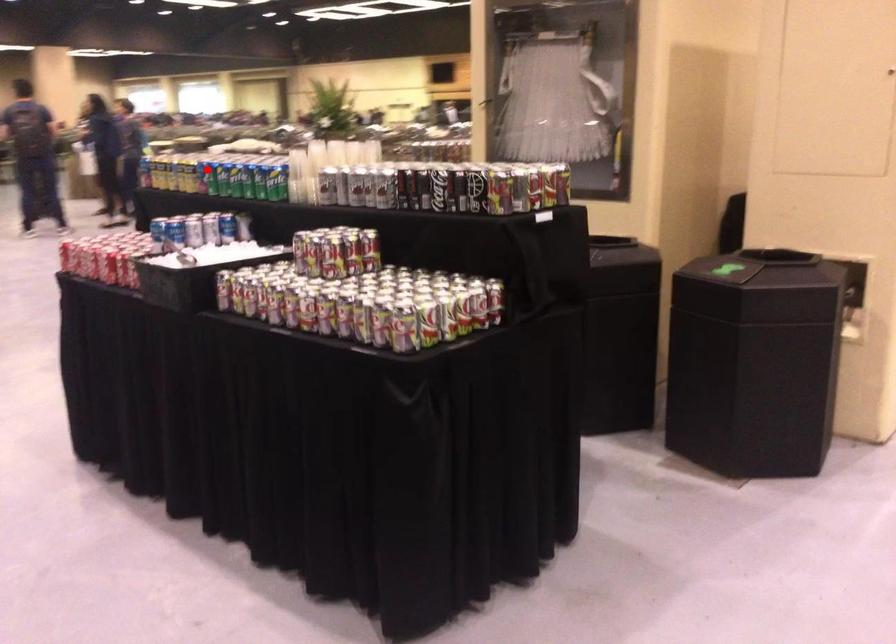
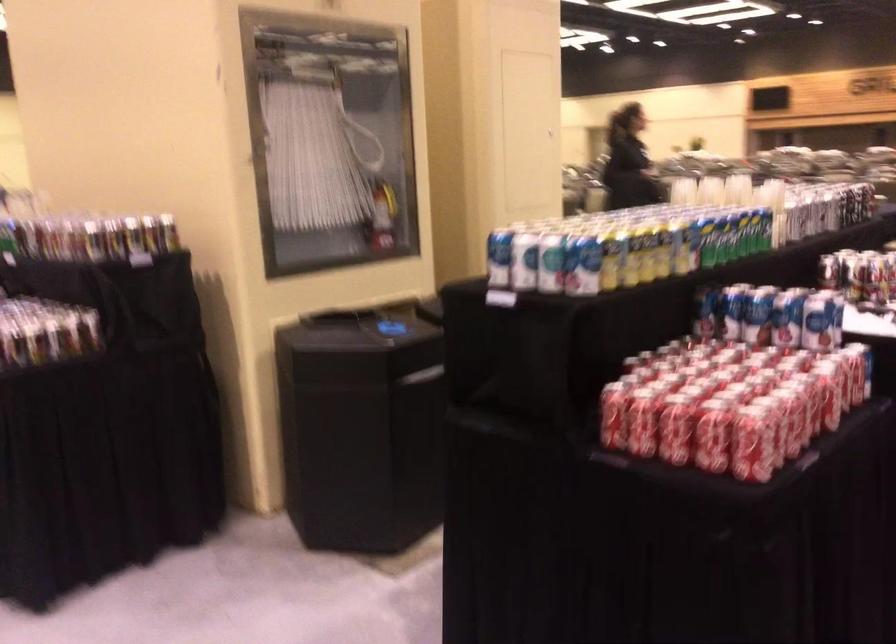
Question: I am providing you with two images of the same scene from different viewpoints. Given a red point in image1, look at the same physical point in image2. Is it:

Choices:
 (A) Closer to the viewpoint
 (B) Farther from the viewpoint

Answer: (A)